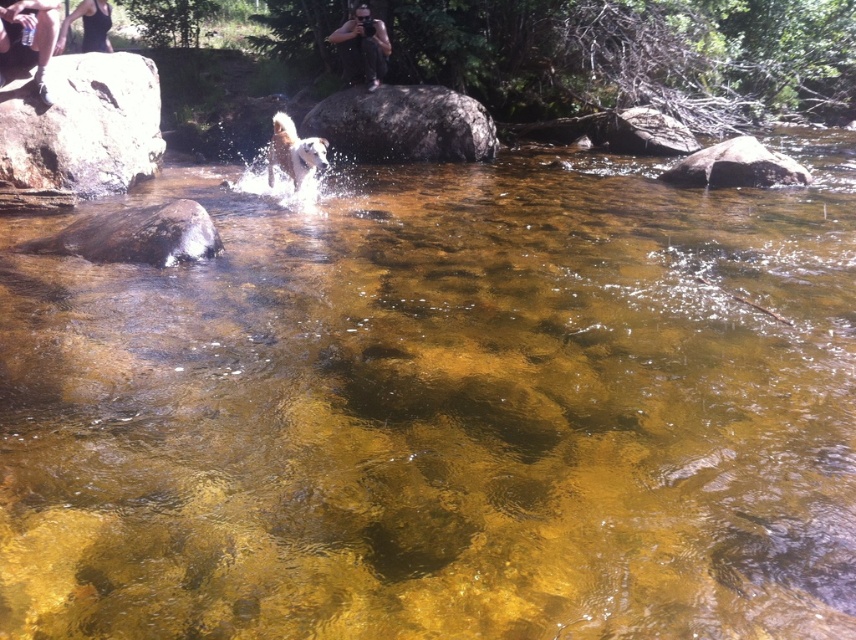
Question: Considering the relative positions of smooth gray rock at upper left and white fur dog at center in the image provided, where is smooth gray rock at upper left located with respect to white fur dog at center?

Choices:
 (A) left
 (B) right

Answer: (A)

Question: Considering the relative positions of matte black camera at upper center and black fabric at upper left in the image provided, where is matte black camera at upper center located with respect to black fabric at upper left?

Choices:
 (A) below
 (B) above

Answer: (B)

Question: Among these points, which one is farthest from the camera?

Choices:
 (A) (49, 147)
 (B) (431, 88)

Answer: (B)

Question: Which point is closer to the camera?

Choices:
 (A) (272, 147)
 (B) (354, 129)

Answer: (A)

Question: Which object appears farthest from the camera in this image?

Choices:
 (A) smooth gray rock at upper left
 (B) matte black shoe at upper left

Answer: (A)

Question: Can you confirm if gray textured rock at center is wider than white fur dog at center?

Choices:
 (A) yes
 (B) no

Answer: (A)